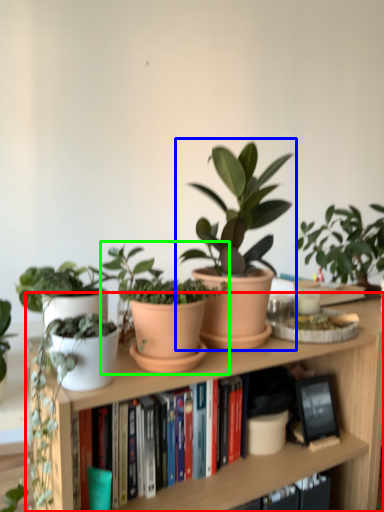
Question: Which is nearer to the bookcase (highlighted by a red box)? houseplant (highlighted by a blue box) or houseplant (highlighted by a green box).

Choices:
 (A) houseplant
 (B) houseplant

Answer: (B)